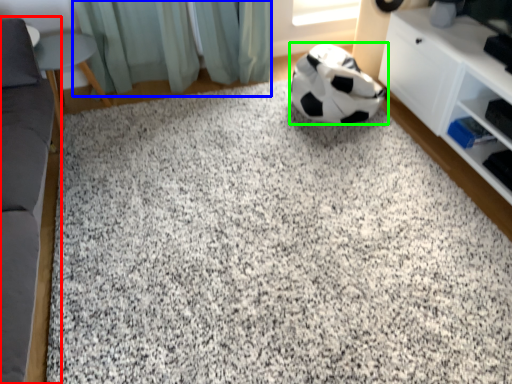
Question: Considering the real-world distances, which object is farthest from furniture (highlighted by a red box)? curtain (highlighted by a blue box) or football (highlighted by a green box)?

Choices:
 (A) curtain
 (B) football

Answer: (B)